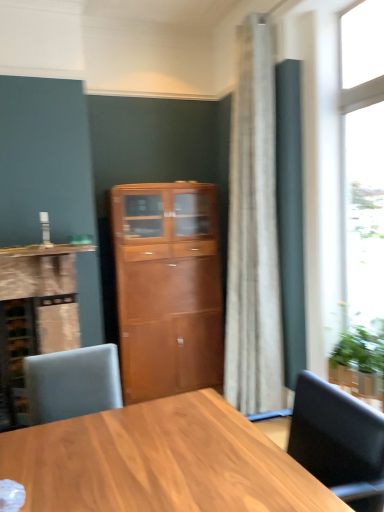
You are a GUI agent. You are given a task and a screenshot of the screen. Output one action in this format:
    pyautogui.click(x=<x>, y=<y>)
    Task: Click on the matte wood cabinet at left
    Image resolution: width=384 pixels, height=512 pixels.
    Given the screenshot: What is the action you would take?
    pyautogui.click(x=39, y=302)

Locate an element on the screen. wooden cabinet at center is located at coordinates tap(167, 288).

Locate an element on the screen. The height and width of the screenshot is (512, 384). cupboard behind the white marble countertop at left is located at coordinates (167, 288).

What's the angular difference between white marble countertop at left and wooden cabinet at center's facing directions?

The facing directions of white marble countertop at left and wooden cabinet at center are 0.13 degrees apart.

Does white marble countertop at left contain wooden cabinet at center?

Definitely not — wooden cabinet at center is not inside white marble countertop at left.

Is white marble countertop at left bigger or smaller than wooden cabinet at center?

white marble countertop at left is smaller than wooden cabinet at center.

Which of these two, matte wood cabinet at left or transparent glass window at right, is bigger?

matte wood cabinet at left.

Does matte wood cabinet at left have a lesser height compared to transparent glass window at right?

Yes.

Considering the sizes of matte wood cabinet at left and transparent glass window at right in the image, is matte wood cabinet at left wider or thinner than transparent glass window at right?

Clearly, matte wood cabinet at left has more width compared to transparent glass window at right.

Is point (0, 300) positioned behind point (375, 120)?

Yes, point (0, 300) is behind point (375, 120).

Can you see white marble countertop at left touching transparent glass window at right?

white marble countertop at left and transparent glass window at right are not in contact.

From a real-world perspective, is white marble countertop at left physically located above or below transparent glass window at right?

white marble countertop at left is below transparent glass window at right.

Between white marble countertop at left and transparent glass window at right, which one appears on the left side from the viewer's perspective?

white marble countertop at left.

Identify the location of window in front of the wooden cabinet at center. (362, 164).

Choose the correct answer: Is wooden cabinet at center inside transparent glass window at right or outside it?

wooden cabinet at center is located beyond the bounds of transparent glass window at right.

Is matte wood cabinet at left turned away from wooden cabinet at center?

matte wood cabinet at left is not turned away from wooden cabinet at center.

Relative to wooden cabinet at center, is matte wood cabinet at left in front or behind?

In the image, matte wood cabinet at left appears in front of wooden cabinet at center.

Are matte wood cabinet at left and wooden cabinet at center making contact?

They are not placed beside each other.

From a real-world perspective, which object stands above the other?

wooden cabinet at center is physically above.

Is point (191, 277) farther from camera compared to point (17, 251)?

Yes, it is.

Considering the relative positions of wooden cabinet at center and white marble countertop at left in the image provided, is wooden cabinet at center to the right of white marble countertop at left from the viewer's perspective?

Yes.

Is wooden cabinet at center outside of white marble countertop at left?

Yes.

Which is behind, wooden cabinet at center or white marble countertop at left?

wooden cabinet at center is behind.

Locate an element on the screen. This screenshot has width=384, height=512. window on the right of the white marble countertop at left is located at coordinates (362, 164).

Between transparent glass window at right and white marble countertop at left, which one has larger width?

With larger width is white marble countertop at left.

Is white marble countertop at left surrounded by transparent glass window at right?

No, white marble countertop at left is located outside of transparent glass window at right.

Is transparent glass window at right oriented towards white marble countertop at left?

No, transparent glass window at right is not oriented towards white marble countertop at left.

Identify the location of counter top on the left of wooden cabinet at center. The image size is (384, 512). (46, 250).

You are a GUI agent. You are given a task and a screenshot of the screen. Output one action in this format:
    pyautogui.click(x=<x>, y=<y>)
    Task: Click on the window in front of the matte wood cabinet at left
    
    Given the screenshot: What is the action you would take?
    pyautogui.click(x=362, y=164)

From the image, which object appears to be nearer to transparent glass window at right, matte wood cabinet at left or white marble countertop at left?

white marble countertop at left lies closer to transparent glass window at right than the other object.

When comparing their distances from matte wood cabinet at left, does wooden cabinet at center or white marble countertop at left seem closer?

Among the two, white marble countertop at left is located nearer to matte wood cabinet at left.

Based on their spatial positions, is matte wood cabinet at left or wooden cabinet at center closer to transparent glass window at right?

wooden cabinet at center.

When comparing their distances from wooden cabinet at center, does matte wood cabinet at left or transparent glass window at right seem closer?

matte wood cabinet at left.

Looking at the image, which one is located further to white marble countertop at left, wooden cabinet at center or transparent glass window at right?

transparent glass window at right is positioned further to the anchor white marble countertop at left.

Estimate the real-world distances between objects in this image. Which object is further from wooden cabinet at center, transparent glass window at right or white marble countertop at left?

transparent glass window at right is further to wooden cabinet at center.

In the scene shown: When comparing their distances from white marble countertop at left, does wooden cabinet at center or matte wood cabinet at left seem further?

wooden cabinet at center is positioned further to the anchor white marble countertop at left.

Based on their spatial positions, is white marble countertop at left or transparent glass window at right further from wooden cabinet at center?

Among the two, transparent glass window at right is located further to wooden cabinet at center.

Find the location of a particular element. cupboard located between matte wood cabinet at left and transparent glass window at right in the left-right direction is located at coordinates (167, 288).

Identify the location of counter top between matte wood cabinet at left and wooden cabinet at center. This screenshot has width=384, height=512. (46, 250).

Find the location of a particular element. counter top between matte wood cabinet at left and transparent glass window at right from left to right is located at coordinates (46, 250).

Locate an element on the screen. This screenshot has height=512, width=384. cupboard situated between white marble countertop at left and transparent glass window at right from left to right is located at coordinates (167, 288).